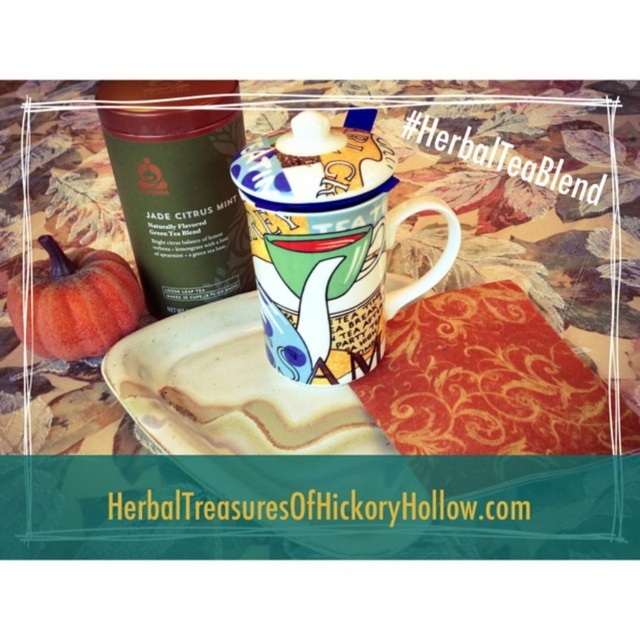
You have a small tray that can only hold items narrower than the tin. If you want to place both the porcelain mug with colorful design at center and the green matte tin at upper left on the tray, which one should you place first to ensure they both fit?

The green matte tin at upper left should be placed first because the porcelain mug with colorful design at center might be wider, so placing the narrower tin first allows the wider mug to fit next if there is space.

You are placing a porcelain mug with colorful design at center on a shelf. The tin container is already on the shelf 20.09 inches away. What is the minimum shelf length needed to accommodate both items without overlapping?

The minimum shelf length needed to accommodate both the porcelain mug with colorful design at center and the tin container without overlapping is 20.09 inches.

You have a small decorative item that needs to be placed on the matte ceramic plate at center. Considering the size of the orange matte pumpkin at lower left, will it fit on the plate?

The matte ceramic plate at center has a larger width than the orange matte pumpkin at lower left, so the pumpkin will fit on the plate.